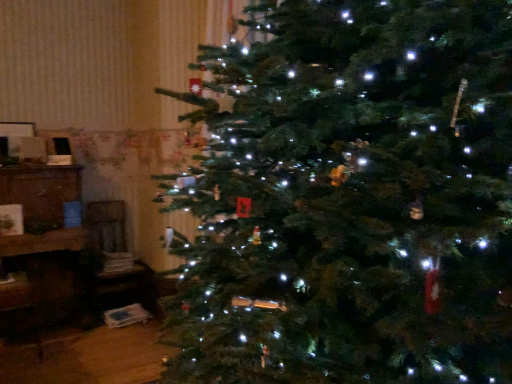
Question: Based on their sizes in the image, would you say green matte christmas tree at center is bigger or smaller than brown wooden cabinet at left?

Choices:
 (A) small
 (B) big

Answer: (B)

Question: Considering the positions of green matte christmas tree at center and brown wooden cabinet at left in the image, is green matte christmas tree at center wider or thinner than brown wooden cabinet at left?

Choices:
 (A) thin
 (B) wide

Answer: (A)

Question: Which object is the farthest from the brown wooden cabinet at left?

Choices:
 (A) green matte christmas tree at center
 (B) wooden chair at left

Answer: (A)

Question: Based on their relative distances, which object is farther from the brown wooden cabinet at left?

Choices:
 (A) wooden chair at left
 (B) green matte christmas tree at center

Answer: (B)